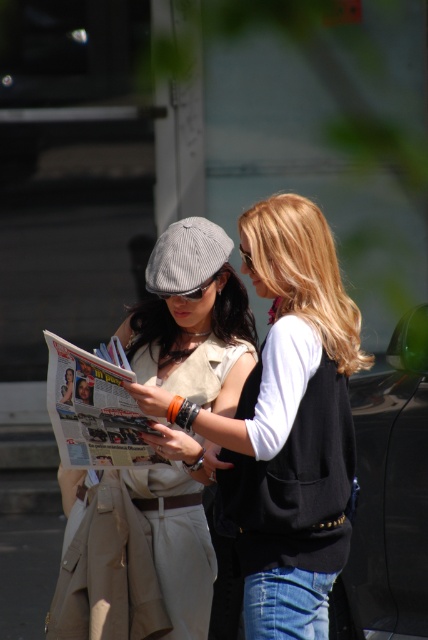
From the picture: Can you confirm if matte beige trench coat at center is positioned above gray corduroy baseball cap at center?

Actually, matte beige trench coat at center is below gray corduroy baseball cap at center.

Does point (284, 330) lie in front of point (180, 248)?

That is True.

You are a GUI agent. You are given a task and a screenshot of the screen. Output one action in this format:
    pyautogui.click(x=<x>, y=<y>)
    Task: Click on the matte beige trench coat at center
    The image size is (428, 640).
    Given the screenshot: What is the action you would take?
    pyautogui.click(x=287, y=424)

Is matte beige trench coat at left above matte gray goggles at center?

Incorrect, matte beige trench coat at left is not positioned above matte gray goggles at center.

Is matte beige trench coat at left shorter than matte gray goggles at center?

In fact, matte beige trench coat at left may be taller than matte gray goggles at center.

Is point (148, 493) farther from camera compared to point (208, 280)?

Yes, it is.

I want to click on matte beige trench coat at left, so click(193, 317).

Is matte beige trench coat at left below gray corduroy baseball cap at center?

Correct, matte beige trench coat at left is located below gray corduroy baseball cap at center.

Can you confirm if matte beige trench coat at left is positioned to the right of gray corduroy baseball cap at center?

In fact, matte beige trench coat at left is to the left of gray corduroy baseball cap at center.

Does point (62, 497) come behind point (172, 285)?

Yes, point (62, 497) is behind point (172, 285).

At what (x,y) coordinates should I click in order to perform the action: click on matte beige trench coat at left. Please return your answer as a coordinate pair (x, y). Looking at the image, I should click on (193, 317).